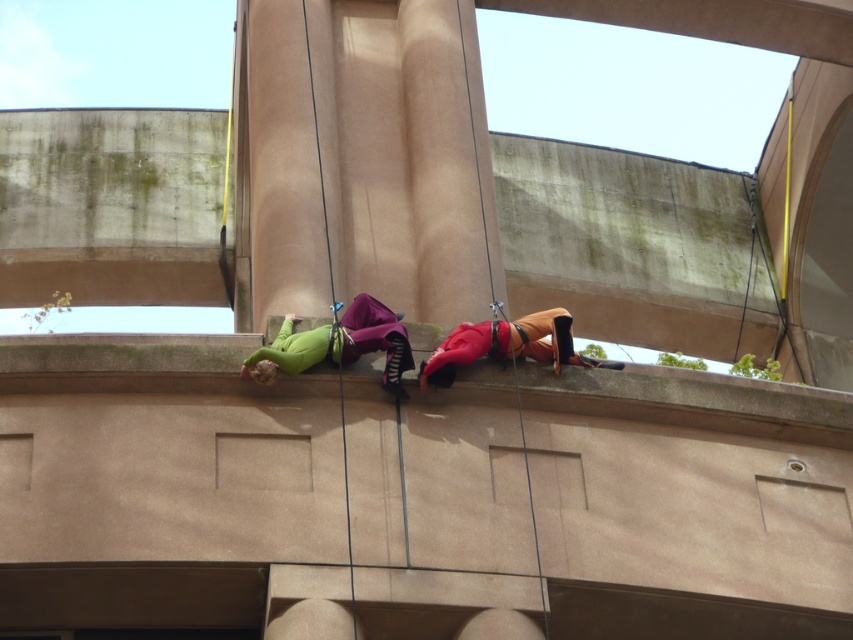
Question: Observing the image, what is the correct spatial positioning of green matte/suede pants at center in reference to orange fabric at center?

Choices:
 (A) left
 (B) right

Answer: (A)

Question: Can you confirm if green matte/suede pants at center is smaller than orange fabric at center?

Choices:
 (A) yes
 (B) no

Answer: (A)

Question: Which point is farther to the camera?

Choices:
 (A) green matte/suede pants at center
 (B) orange fabric at center

Answer: (B)

Question: Is green matte/suede pants at center to the left of orange fabric at center from the viewer's perspective?

Choices:
 (A) no
 (B) yes

Answer: (B)

Question: Which object is closer to the camera taking this photo?

Choices:
 (A) orange fabric at center
 (B) green matte/suede pants at center

Answer: (B)